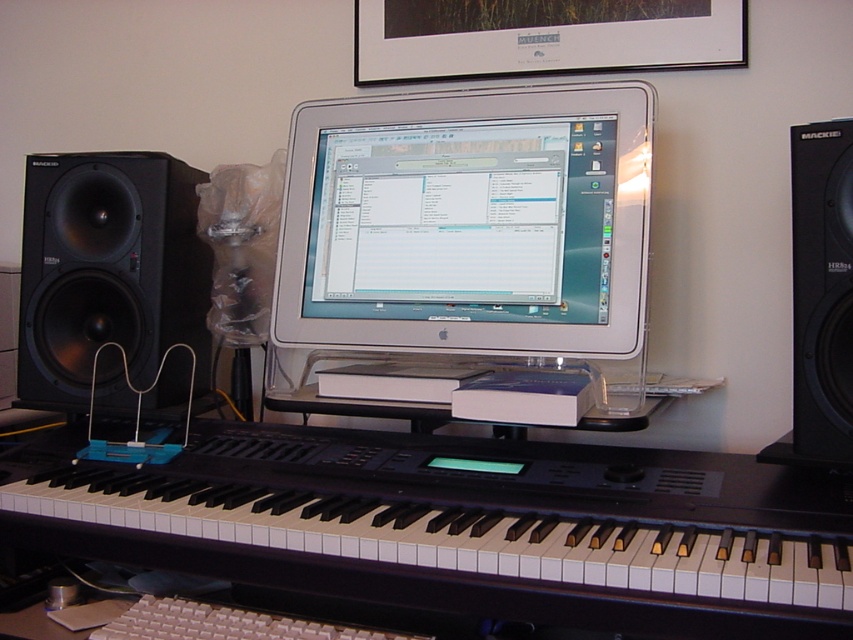
Question: Which of the following is the closest to the observer?

Choices:
 (A) black matte speaker at left
 (B) white glossy desktop computer at center

Answer: (B)

Question: Does white glossy desktop computer at center have a lesser width compared to white plastic keyboard at center?

Choices:
 (A) no
 (B) yes

Answer: (A)

Question: Which object appears closest to the camera in this image?

Choices:
 (A) black matte speaker at left
 (B) black matte speaker at right
 (C) black plastic keyboard at lower center
 (D) white glossy desktop computer at center

Answer: (C)

Question: Which of the following is the closest to the observer?

Choices:
 (A) (531, 221)
 (B) (54, 513)

Answer: (B)

Question: Does black matte speaker at left appear under black matte speaker at right?

Choices:
 (A) no
 (B) yes

Answer: (A)

Question: Observing the image, what is the correct spatial positioning of black plastic keyboard at lower center in reference to black matte speaker at left?

Choices:
 (A) left
 (B) right

Answer: (B)